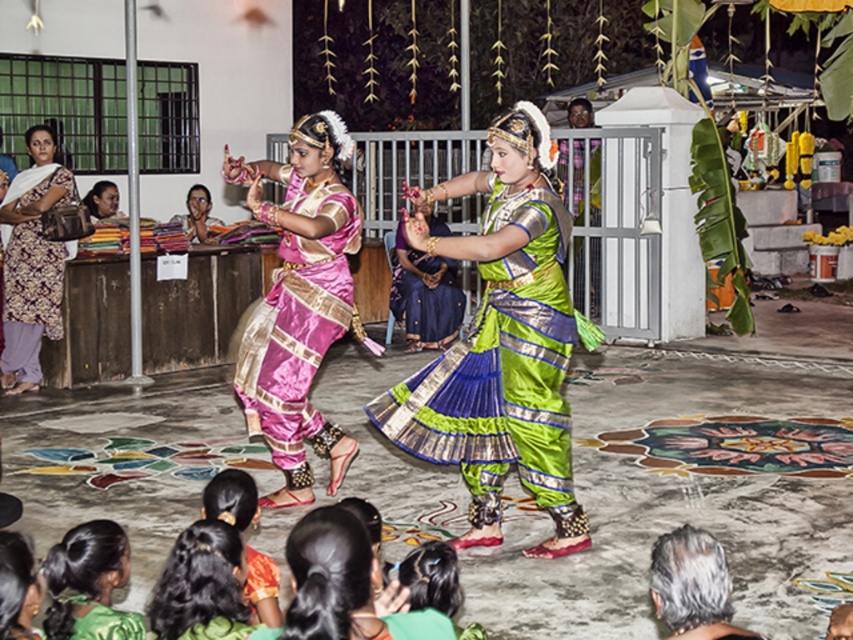
Does silky green saree at lower left have a greater width compared to green silk saree at lower left?

Yes, silky green saree at lower left is wider than green silk saree at lower left.

Who is more distant from viewer, (161,589) or (64,552)?

The point (64,552) is behind.

Locate an element on the screen. This screenshot has width=853, height=640. silky green saree at lower left is located at coordinates (202, 586).

Does green silk saree at center have a greater height compared to printed cotton kurta at left?

Correct, green silk saree at center is much taller as printed cotton kurta at left.

Which is below, green silk saree at center or printed cotton kurta at left?

Positioned lower is green silk saree at center.

What do you see at coordinates (500, 342) in the screenshot? The image size is (853, 640). I see `green silk saree at center` at bounding box center [500, 342].

This screenshot has width=853, height=640. What are the coordinates of `green silk saree at center` in the screenshot? It's located at (500, 342).

Image resolution: width=853 pixels, height=640 pixels. I want to click on pink satin saree at center, so click(x=300, y=301).

Describe the element at coordinates (300, 301) in the screenshot. The image size is (853, 640). I see `pink satin saree at center` at that location.

This screenshot has height=640, width=853. I want to click on pink satin saree at center, so 300,301.